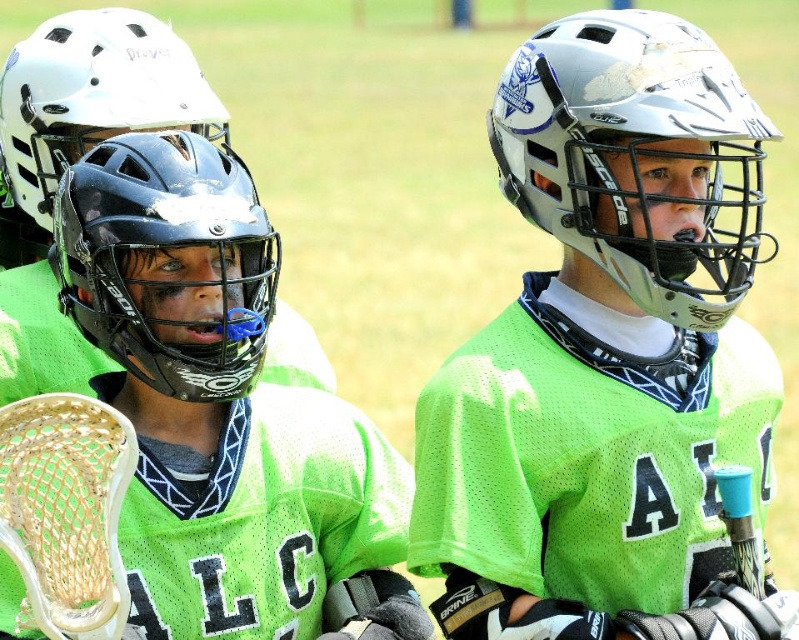
Question: Is white matte helmet at center positioned at the back of black matte helmet at center?

Choices:
 (A) yes
 (B) no

Answer: (A)

Question: Does white matte helmet at center appear under black matte helmet at center?

Choices:
 (A) no
 (B) yes

Answer: (A)

Question: Is white matte helmet at center wider than black matte helmet at center?

Choices:
 (A) no
 (B) yes

Answer: (B)

Question: Which point appears closest to the camera in this image?

Choices:
 (A) (646, 56)
 (B) (211, 353)
 (C) (158, 116)

Answer: (B)

Question: Which point is closer to the camera taking this photo?

Choices:
 (A) (22, 90)
 (B) (646, 12)
 (C) (197, 394)

Answer: (C)

Question: Which object is the closest to the white matte helmet at upper left?

Choices:
 (A) white matte helmet at center
 (B) black matte helmet at center

Answer: (B)